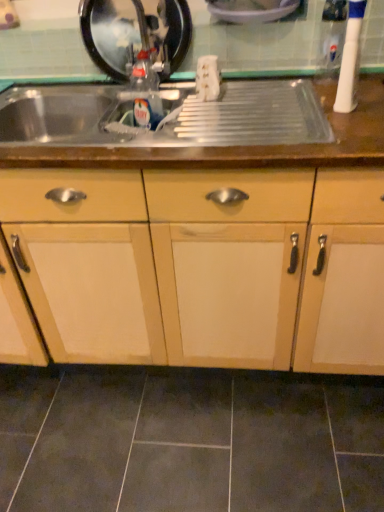
Question: Considering the relative positions of white plastic toothbrush at upper right, which is counted as the third appliance, starting from the left, and dark gray ceramic tile at lower center in the image provided, is white plastic toothbrush at upper right, which is counted as the third appliance, starting from the left, to the right of dark gray ceramic tile at lower center from the viewer's perspective?

Choices:
 (A) yes
 (B) no

Answer: (A)

Question: Is white plastic toothbrush at upper right, which is counted as the third appliance, starting from the left, looking in the opposite direction of dark gray ceramic tile at lower center?

Choices:
 (A) yes
 (B) no

Answer: (B)

Question: Considering the relative positions of white plastic toothbrush at upper right, which is counted as the third appliance, starting from the left, and dark gray ceramic tile at lower center in the image provided, is white plastic toothbrush at upper right, which is counted as the third appliance, starting from the left, to the left of dark gray ceramic tile at lower center from the viewer's perspective?

Choices:
 (A) no
 (B) yes

Answer: (A)

Question: Considering the relative sizes of white plastic toothbrush at upper right, the 1th appliance viewed from the right, and dark gray ceramic tile at lower center in the image provided, is white plastic toothbrush at upper right, the 1th appliance viewed from the right, taller than dark gray ceramic tile at lower center?

Choices:
 (A) yes
 (B) no

Answer: (A)

Question: From the image's perspective, does white plastic toothbrush at upper right, which is counted as the third appliance, starting from the left, appear higher than dark gray ceramic tile at lower center?

Choices:
 (A) no
 (B) yes

Answer: (B)

Question: From a real-world perspective, is white plastic toothbrush at upper right, the 1th appliance viewed from the right, on top of dark gray ceramic tile at lower center?

Choices:
 (A) no
 (B) yes

Answer: (B)

Question: Is metallic stainless steel sink at upper center surrounded by dark gray ceramic tile at lower center?

Choices:
 (A) no
 (B) yes

Answer: (A)

Question: Is the position of dark gray ceramic tile at lower center less distant than that of metallic stainless steel sink at upper center?

Choices:
 (A) no
 (B) yes

Answer: (A)

Question: Is metallic stainless steel sink at upper center at the back of dark gray ceramic tile at lower center?

Choices:
 (A) no
 (B) yes

Answer: (A)

Question: From a real-world perspective, is dark gray ceramic tile at lower center located beneath metallic stainless steel sink at upper center?

Choices:
 (A) yes
 (B) no

Answer: (A)

Question: Could you tell me if dark gray ceramic tile at lower center is turned towards metallic stainless steel sink at upper center?

Choices:
 (A) yes
 (B) no

Answer: (B)

Question: Is dark gray ceramic tile at lower center smaller than metallic stainless steel sink at upper center?

Choices:
 (A) yes
 (B) no

Answer: (A)

Question: From the image's perspective, is metallic black sink at upper left, placed as the 1th appliance when sorted from left to right, below metallic stainless steel sink at upper center?

Choices:
 (A) no
 (B) yes

Answer: (A)